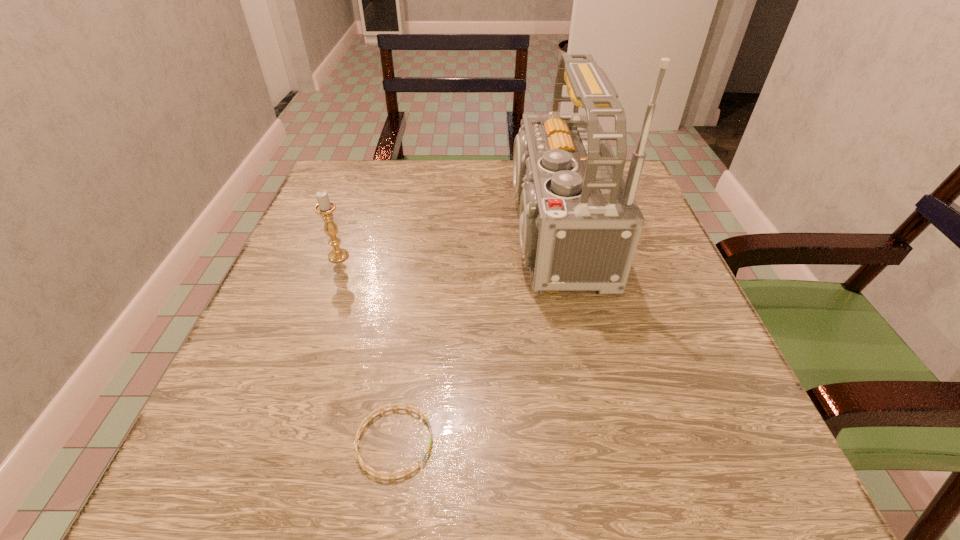
Locate an element on the screen. the rightmost object is located at coordinates click(x=579, y=223).

This screenshot has width=960, height=540. Identify the location of the tallest object. (579, 223).

Find the location of a particular element. The height and width of the screenshot is (540, 960). the leftmost object is located at coordinates (325, 207).

Where is `candle holder`? candle holder is located at coordinates (325, 207).

Identify the location of the shortest object. (378, 474).

Find the location of a particular element. This screenshot has height=540, width=960. bracelet is located at coordinates (378, 474).

This screenshot has width=960, height=540. I want to click on vacant area situated on the front-facing side of the radio receiver, so click(x=315, y=232).

The height and width of the screenshot is (540, 960). In order to click on free space located 0.220m on the front-facing side of the radio receiver in this screenshot , I will do `click(384, 232)`.

Identify the location of vacant point located 0.340m on the front-facing side of the radio receiver. (329, 232).

Identify the location of vacant area located 0.320m on the back of the second shortest object. (369, 171).